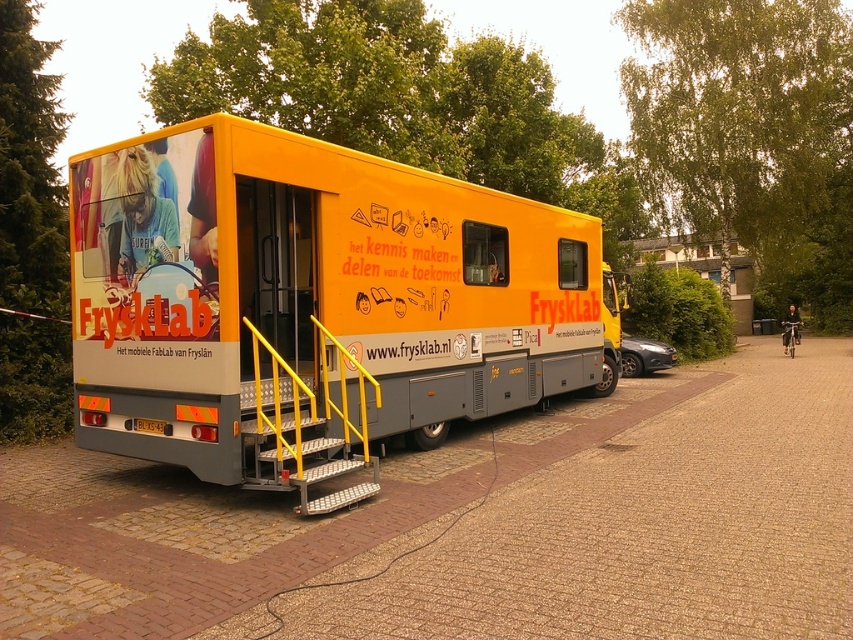
Question: Considering the relative positions of yellow matte truck at center and matte black car at center-right in the image provided, where is yellow matte truck at center located with respect to matte black car at center-right?

Choices:
 (A) left
 (B) right

Answer: (A)

Question: Among these objects, which one is farthest from the camera?

Choices:
 (A) yellow matte truck at center
 (B) yellow metallic/stainless steel stairs at center
 (C) matte black car at center-right

Answer: (C)

Question: Does yellow matte truck at center come behind yellow metallic/stainless steel stairs at center?

Choices:
 (A) yes
 (B) no

Answer: (A)

Question: Does yellow matte truck at center have a lesser width compared to matte yellow advertisement at center?

Choices:
 (A) no
 (B) yes

Answer: (A)

Question: Which object appears closest to the camera in this image?

Choices:
 (A) matte yellow advertisement at center
 (B) yellow matte truck at center

Answer: (B)

Question: Which of the following is the closest to the observer?

Choices:
 (A) (318, 420)
 (B) (114, 326)
 (C) (312, 442)

Answer: (C)